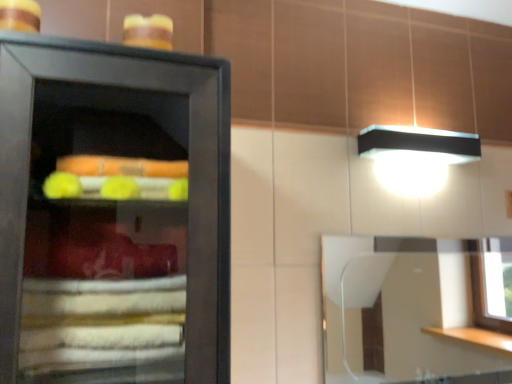
Where is `clear glass mirror at upper right`? The width and height of the screenshot is (512, 384). clear glass mirror at upper right is located at coordinates (411, 307).

What do you see at coordinates (411, 307) in the screenshot?
I see `clear glass mirror at upper right` at bounding box center [411, 307].

This screenshot has width=512, height=384. Describe the element at coordinates (148, 31) in the screenshot. I see `yellow frosted cake at upper left` at that location.

In order to face yellow frosted cake at upper left, should I rotate leftwards or rightwards?

You should rotate left by 13.935 degrees.

Image resolution: width=512 pixels, height=384 pixels. Find the location of `yellow frosted cake at upper left`. yellow frosted cake at upper left is located at coordinates (148, 31).

The image size is (512, 384). In order to click on clear glass mirror at upper right in this screenshot , I will do `click(411, 307)`.

Between yellow frosted cake at upper left and clear glass mirror at upper right, which one appears on the left side from the viewer's perspective?

From the viewer's perspective, yellow frosted cake at upper left appears more on the left side.

Is yellow frosted cake at upper left positioned before clear glass mirror at upper right?

That is True.

Does point (141, 46) appear closer or farther from the camera than point (446, 322)?

Point (141, 46) is closer to the camera than point (446, 322).

From the image's perspective, between yellow frosted cake at upper left and clear glass mirror at upper right, which one is located above?

yellow frosted cake at upper left appears higher in the image.

From a real-world perspective, relative to clear glass mirror at upper right, is yellow frosted cake at upper left vertically above or below?

In terms of real-world spatial position, yellow frosted cake at upper left is above clear glass mirror at upper right.

Is yellow frosted cake at upper left thinner than clear glass mirror at upper right?

No, yellow frosted cake at upper left is not thinner than clear glass mirror at upper right.

Can you confirm if yellow frosted cake at upper left is taller than clear glass mirror at upper right?

No, yellow frosted cake at upper left is not taller than clear glass mirror at upper right.

Considering the relative sizes of yellow frosted cake at upper left and clear glass mirror at upper right in the image provided, is yellow frosted cake at upper left bigger than clear glass mirror at upper right?

No.

Based on the photo, which is correct: yellow frosted cake at upper left is inside clear glass mirror at upper right, or outside of it?

yellow frosted cake at upper left is spatially situated outside clear glass mirror at upper right.

Is yellow frosted cake at upper left far from clear glass mirror at upper right?

Yes.

Could you tell me if yellow frosted cake at upper left is facing clear glass mirror at upper right?

No, yellow frosted cake at upper left is not facing towards clear glass mirror at upper right.

From the picture: How many degrees apart are the facing directions of yellow frosted cake at upper left and clear glass mirror at upper right?

The angle between the facing direction of yellow frosted cake at upper left and the facing direction of clear glass mirror at upper right is 1.11 degrees.

The image size is (512, 384). In order to click on food on the left of clear glass mirror at upper right in this screenshot , I will do `click(148, 31)`.

Would you say clear glass mirror at upper right is to the left or to the right of yellow frosted cake at upper left in the picture?

In the image, clear glass mirror at upper right appears on the right side of yellow frosted cake at upper left.

Between clear glass mirror at upper right and yellow frosted cake at upper left, which one is positioned behind?

clear glass mirror at upper right is further away from the camera.

Considering the points (398, 336) and (132, 38), which point is in front, point (398, 336) or point (132, 38)?

Positioned in front is point (132, 38).

From the image's perspective, which is above, clear glass mirror at upper right or yellow frosted cake at upper left?

yellow frosted cake at upper left.

From a real-world perspective, is clear glass mirror at upper right physically located above or below yellow frosted cake at upper left?

Clearly, from a real-world perspective, clear glass mirror at upper right is below yellow frosted cake at upper left.

Considering the sizes of objects clear glass mirror at upper right and yellow frosted cake at upper left in the image provided, who is wider, clear glass mirror at upper right or yellow frosted cake at upper left?

With larger width is yellow frosted cake at upper left.

Does clear glass mirror at upper right have a greater height compared to yellow frosted cake at upper left?

Correct, clear glass mirror at upper right is much taller as yellow frosted cake at upper left.

Who is smaller, clear glass mirror at upper right or yellow frosted cake at upper left?

With smaller size is yellow frosted cake at upper left.

From the picture: Is clear glass mirror at upper right inside the boundaries of yellow frosted cake at upper left, or outside?

clear glass mirror at upper right is outside yellow frosted cake at upper left.

Is clear glass mirror at upper right placed right next to yellow frosted cake at upper left?

There is a gap between clear glass mirror at upper right and yellow frosted cake at upper left.

Is clear glass mirror at upper right positioned with its back to yellow frosted cake at upper left?

No, clear glass mirror at upper right's orientation is not away from yellow frosted cake at upper left.

Measure the distance from clear glass mirror at upper right to yellow frosted cake at upper left.

clear glass mirror at upper right is 9.84 feet from yellow frosted cake at upper left.

Image resolution: width=512 pixels, height=384 pixels. Find the location of `mirror behind the yellow frosted cake at upper left`. mirror behind the yellow frosted cake at upper left is located at coordinates (411, 307).

You are a GUI agent. You are given a task and a screenshot of the screen. Output one action in this format:
    pyautogui.click(x=<x>, y=<y>)
    Task: Click on the food in front of the clear glass mirror at upper right
    
    Given the screenshot: What is the action you would take?
    pyautogui.click(x=148, y=31)

Find the location of a particular element. The height and width of the screenshot is (384, 512). mirror behind the yellow frosted cake at upper left is located at coordinates (411, 307).